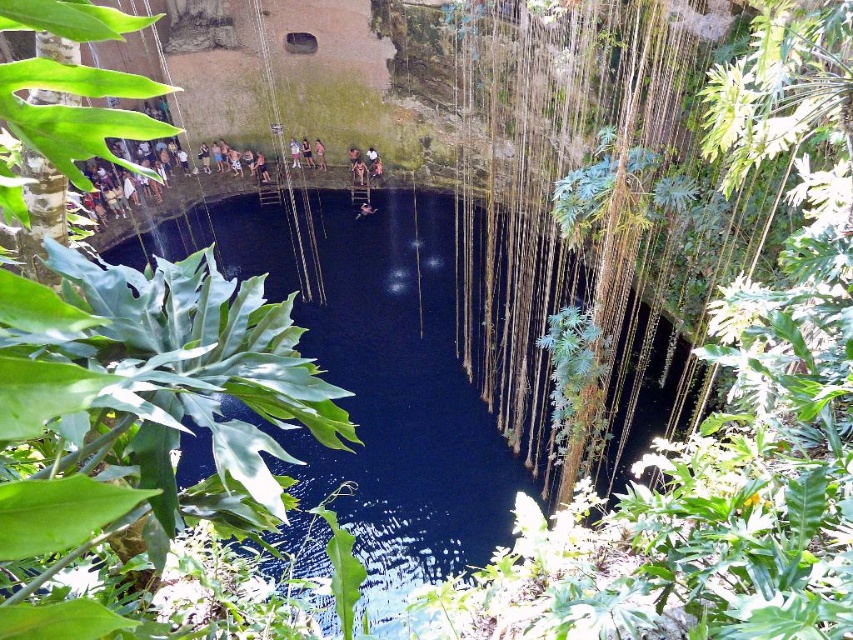
Does light brown wooden pole at center have a lesser width compared to pink fabric dress at center?

In fact, light brown wooden pole at center might be wider than pink fabric dress at center.

Is point (294, 164) in front of point (318, 141)?

No, it is behind (318, 141).

Where is `light brown wooden pole at center`? This screenshot has height=640, width=853. light brown wooden pole at center is located at coordinates (294, 152).

Does transparent water at center appear under light brown wooden ladder at upper center?

Yes, transparent water at center is below light brown wooden ladder at upper center.

Which is more to the right, transparent water at center or light brown wooden ladder at upper center?

Positioned to the right is transparent water at center.

Image resolution: width=853 pixels, height=640 pixels. What do you see at coordinates (374, 374) in the screenshot?
I see `transparent water at center` at bounding box center [374, 374].

This screenshot has width=853, height=640. I want to click on transparent water at center, so click(x=374, y=374).

How distant is transparent water at center from pink fabric dress at center?

transparent water at center is 56.08 feet away from pink fabric dress at center.

Is transparent water at center smaller than pink fabric dress at center?

Incorrect, transparent water at center is not smaller in size than pink fabric dress at center.

What do you see at coordinates (374, 374) in the screenshot? This screenshot has height=640, width=853. I see `transparent water at center` at bounding box center [374, 374].

Image resolution: width=853 pixels, height=640 pixels. I want to click on transparent water at center, so click(x=374, y=374).